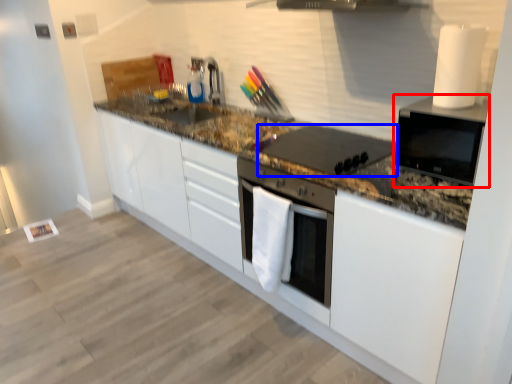
Question: Which of the following is the closest to the observer, home appliance (highlighted by a red box) or kitchen appliance (highlighted by a blue box)?

Choices:
 (A) home appliance
 (B) kitchen appliance

Answer: (A)